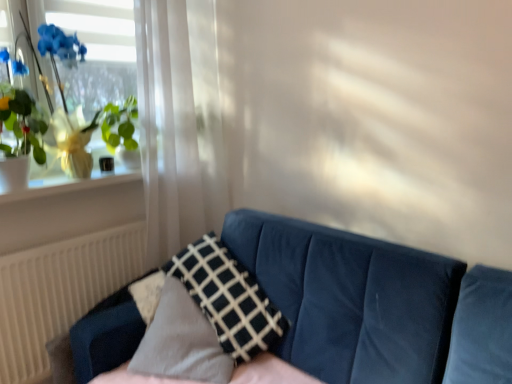
Question: Is white textured radiator at lower left next to dark blue fabric pillow at center?

Choices:
 (A) no
 (B) yes

Answer: (A)

Question: Is white textured radiator at lower left smaller than dark blue fabric pillow at center?

Choices:
 (A) no
 (B) yes

Answer: (B)

Question: From the image's perspective, is white textured radiator at lower left below dark blue fabric pillow at center?

Choices:
 (A) no
 (B) yes

Answer: (B)

Question: Is there a large distance between white textured radiator at lower left and dark blue fabric pillow at center?

Choices:
 (A) yes
 (B) no

Answer: (B)

Question: Can you confirm if white textured radiator at lower left is taller than dark blue fabric pillow at center?

Choices:
 (A) yes
 (B) no

Answer: (A)

Question: From a real-world perspective, is white textured radiator at lower left located beneath dark blue fabric pillow at center?

Choices:
 (A) no
 (B) yes

Answer: (B)

Question: Considering the relative positions of white sheer curtain at left and white glossy window sill at upper left in the image provided, is white sheer curtain at left to the right of white glossy window sill at upper left from the viewer's perspective?

Choices:
 (A) yes
 (B) no

Answer: (A)

Question: Can you confirm if white sheer curtain at left is taller than white glossy window sill at upper left?

Choices:
 (A) yes
 (B) no

Answer: (A)

Question: Does white sheer curtain at left have a lesser width compared to white glossy window sill at upper left?

Choices:
 (A) no
 (B) yes

Answer: (B)

Question: Is white sheer curtain at left oriented towards white glossy window sill at upper left?

Choices:
 (A) yes
 (B) no

Answer: (B)

Question: Are white sheer curtain at left and white glossy window sill at upper left beside each other?

Choices:
 (A) yes
 (B) no

Answer: (B)

Question: Does white sheer curtain at left come in front of white glossy window sill at upper left?

Choices:
 (A) yes
 (B) no

Answer: (B)

Question: Considering the relative sizes of white sheer curtain at left and dark blue fabric pillow at center in the image provided, is white sheer curtain at left smaller than dark blue fabric pillow at center?

Choices:
 (A) yes
 (B) no

Answer: (B)